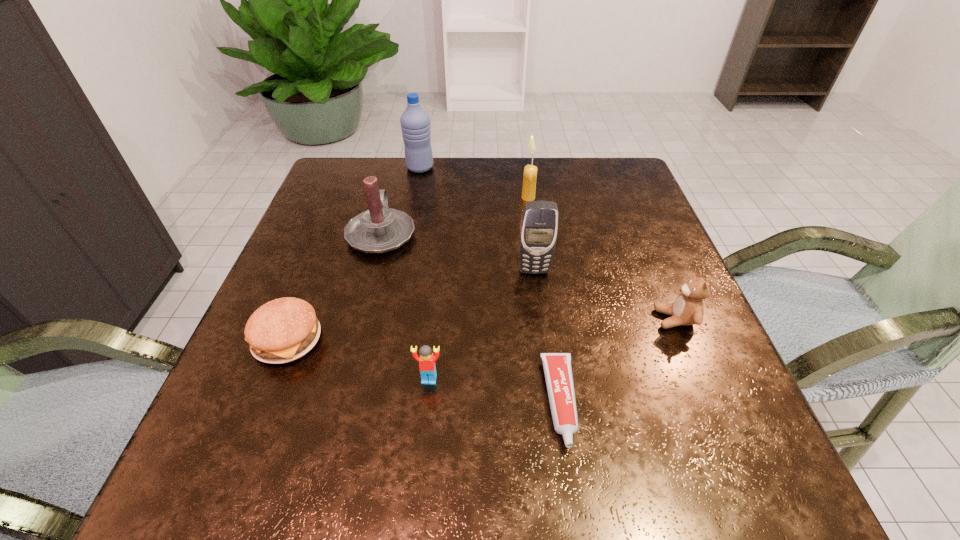
Where is `water bottle`? This screenshot has height=540, width=960. water bottle is located at coordinates (415, 122).

Locate an element on the screen. the seventh nearest object is located at coordinates (530, 171).

Where is `the right candle`? This screenshot has width=960, height=540. the right candle is located at coordinates (530, 171).

Find the location of a particular element. The width and height of the screenshot is (960, 540). cellular telephone is located at coordinates (539, 223).

Where is `the nearer candle`? the nearer candle is located at coordinates (380, 229).

The image size is (960, 540). Find the location of `the left candle`. the left candle is located at coordinates (380, 229).

You are a GUI agent. You are given a task and a screenshot of the screen. Output one action in this format:
    pyautogui.click(x=<x>, y=<y>)
    Task: Click on the teddy bear
    
    Given the screenshot: What is the action you would take?
    pyautogui.click(x=688, y=308)

Locate an element on the screen. The image size is (960, 540). the rightmost object is located at coordinates (688, 308).

I want to click on the fifth object from right to left, so click(x=427, y=368).

The image size is (960, 540). I want to click on the third shortest object, so click(x=427, y=368).